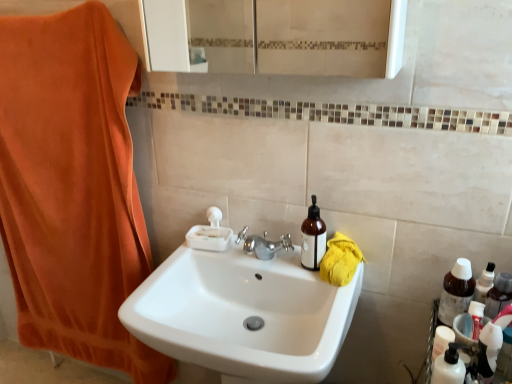
Question: Considering the relative sizes of yellow cotton towel at right and brown glass bottle at upper right, the first bottle from the left, in the image provided, is yellow cotton towel at right smaller than brown glass bottle at upper right, the first bottle from the left,?

Choices:
 (A) no
 (B) yes

Answer: (A)

Question: Is yellow cotton towel at right surrounding brown glass bottle at upper right, placed as the second bottle when sorted from right to left?

Choices:
 (A) no
 (B) yes

Answer: (A)

Question: From the image's perspective, is yellow cotton towel at right over brown glass bottle at upper right, placed as the second bottle when sorted from right to left?

Choices:
 (A) yes
 (B) no

Answer: (B)

Question: Is yellow cotton towel at right wider than brown glass bottle at upper right, placed as the second bottle when sorted from right to left?

Choices:
 (A) no
 (B) yes

Answer: (B)

Question: Is yellow cotton towel at right outside brown glass bottle at upper right, the first bottle from the left?

Choices:
 (A) no
 (B) yes

Answer: (B)

Question: From the image's perspective, is translucent plastic toothpaste tube at lower right above or below white glossy sink at center?

Choices:
 (A) above
 (B) below

Answer: (A)

Question: Is translucent plastic toothpaste tube at lower right to the left or to the right of white glossy sink at center in the image?

Choices:
 (A) left
 (B) right

Answer: (B)

Question: Looking at their shapes, would you say translucent plastic toothpaste tube at lower right is wider or thinner than white glossy sink at center?

Choices:
 (A) wide
 (B) thin

Answer: (B)

Question: Looking at the image, does translucent plastic toothpaste tube at lower right seem bigger or smaller compared to white glossy sink at center?

Choices:
 (A) small
 (B) big

Answer: (A)

Question: From a real-world perspective, is translucent plastic toothpaste tube at lower right above or below brown glass bottle at upper right, the first bottle from the left?

Choices:
 (A) below
 (B) above

Answer: (A)

Question: Is translucent plastic toothpaste tube at lower right situated inside brown glass bottle at upper right, the first bottle from the left, or outside?

Choices:
 (A) inside
 (B) outside

Answer: (B)

Question: Looking at the image, does translucent plastic toothpaste tube at lower right seem bigger or smaller compared to brown glass bottle at upper right, the first bottle from the left?

Choices:
 (A) big
 (B) small

Answer: (B)

Question: Considering the relative positions of translucent plastic toothpaste tube at lower right and brown glass bottle at upper right, placed as the second bottle when sorted from right to left, in the image provided, is translucent plastic toothpaste tube at lower right to the left or to the right of brown glass bottle at upper right, placed as the second bottle when sorted from right to left,?

Choices:
 (A) right
 (B) left

Answer: (A)

Question: Based on their sizes in the image, would you say translucent plastic bottle at lower right is bigger or smaller than translucent plastic toothpaste tube at lower right?

Choices:
 (A) big
 (B) small

Answer: (B)

Question: Choose the correct answer: Is translucent plastic bottle at lower right inside translucent plastic toothpaste tube at lower right or outside it?

Choices:
 (A) outside
 (B) inside

Answer: (A)